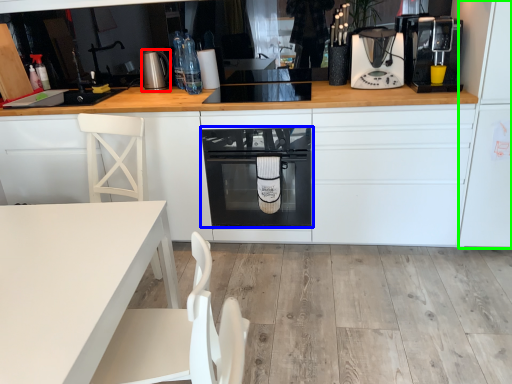
Question: Based on their relative distances, which object is farther from kitchen appliance (highlighted by a red box)? Choose from home appliance (highlighted by a blue box) and fridge (highlighted by a green box).

Choices:
 (A) home appliance
 (B) fridge

Answer: (B)